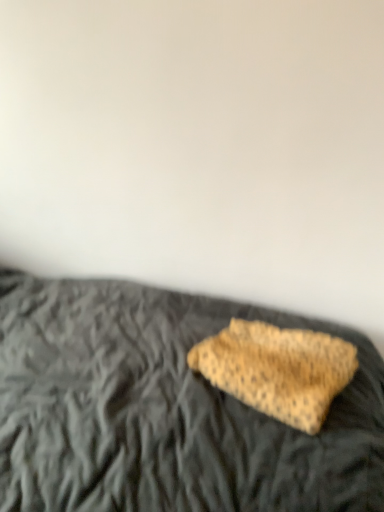
Question: Looking at the image, does leopard print fabric at center seem bigger or smaller compared to leopard print pillow at center?

Choices:
 (A) big
 (B) small

Answer: (B)

Question: From a real-world perspective, relative to leopard print pillow at center, is leopard print fabric at center vertically above or below?

Choices:
 (A) below
 (B) above

Answer: (B)

Question: From the image's perspective, relative to leopard print pillow at center, is leopard print fabric at center above or below?

Choices:
 (A) above
 (B) below

Answer: (A)

Question: From a real-world perspective, is leopard print pillow at center positioned above or below leopard print fabric at center?

Choices:
 (A) above
 (B) below

Answer: (B)

Question: Is leopard print pillow at center inside or outside of leopard print fabric at center?

Choices:
 (A) outside
 (B) inside

Answer: (A)

Question: Is leopard print pillow at center to the left or to the right of leopard print fabric at center in the image?

Choices:
 (A) right
 (B) left

Answer: (B)

Question: Considering the positions of point (x=36, y=297) and point (x=243, y=362), is point (x=36, y=297) closer or farther from the camera than point (x=243, y=362)?

Choices:
 (A) farther
 (B) closer

Answer: (A)